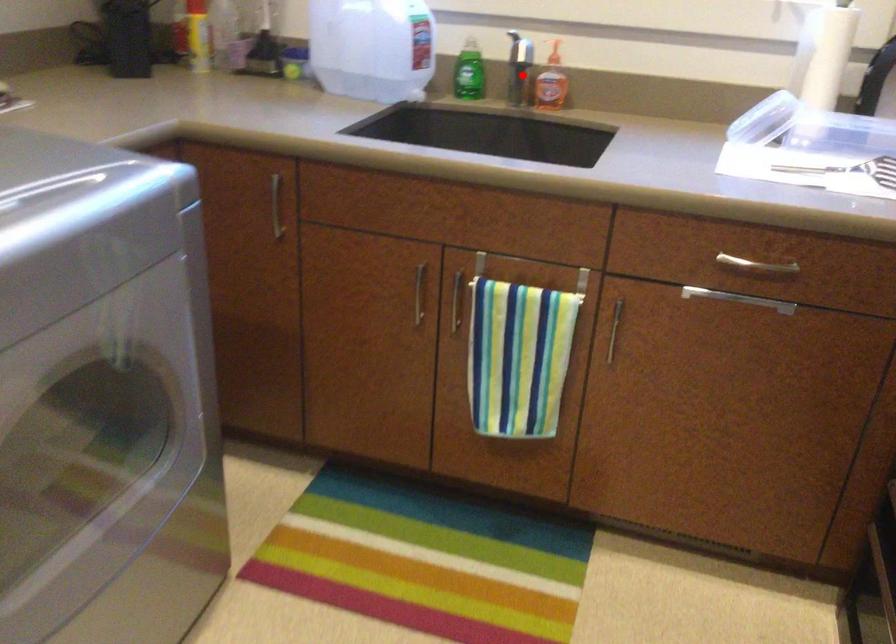
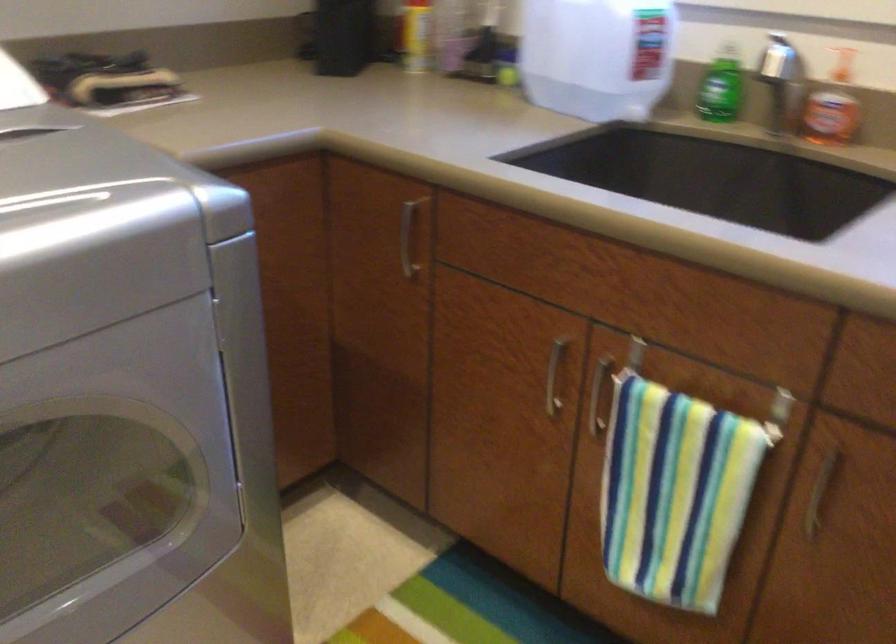
The point at the highlighted location is marked in the first image. Where is the corresponding point in the second image?

(788, 96)